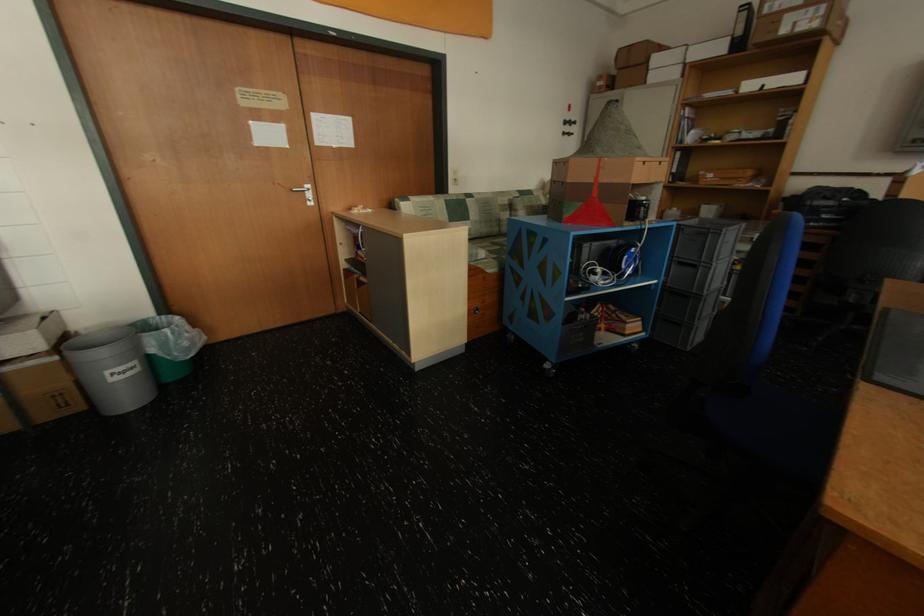
You are a GUI agent. You are given a task and a screenshot of the screen. Output one action in this format:
    pyautogui.click(x=<x>, y=<y>)
    Task: Click on the grey plastic crate
    The width and height of the screenshot is (924, 616).
    Given the screenshot: What is the action you would take?
    pyautogui.click(x=710, y=237)